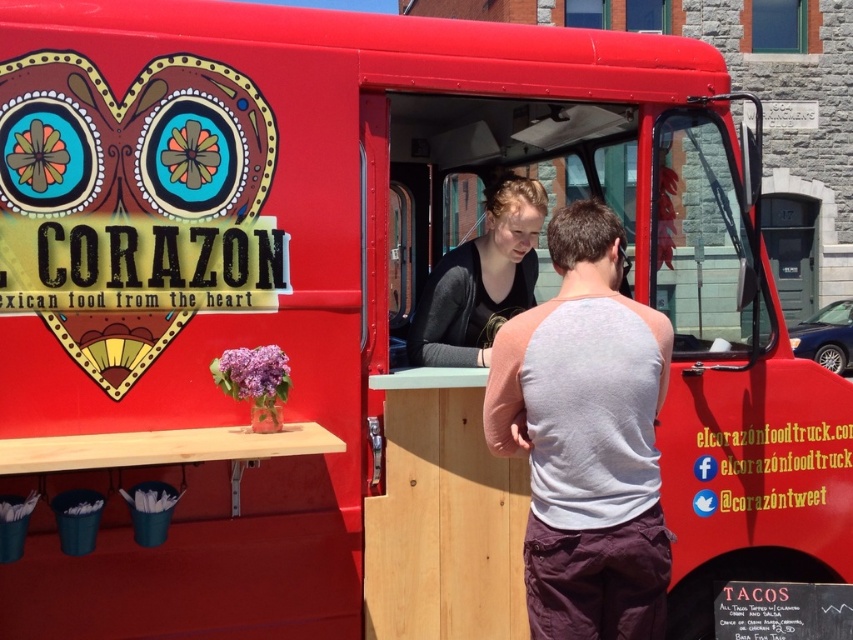
You are a customer at the food truck and want to identify the staff member based on their clothing. You notice two people at the counter area wearing the gray fabric tank top at center and the matte black shirt at center. Which staff member is wearing a larger clothing item?

The gray fabric tank top at center is larger in size than the matte black shirt at center, so the staff member wearing the gray fabric tank top at center has the larger clothing item.

In the scene shown: You are a customer waiting in line for the food truck. You notice two points marked on the ground near the serving counter. The first point is at coordinates point (x=664, y=589), and the second is at point (x=412, y=323). From your perspective standing in line, which point is closer to the serving counter?

Point (x=664, y=589) is in front of point (x=412, y=323), so it is closer to the serving counter.